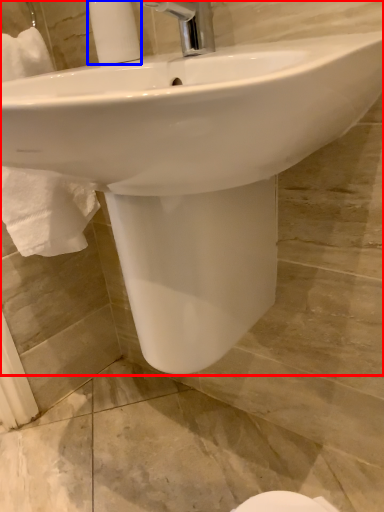
Question: Which of the following is the farthest to the observer, sink (highlighted by a red box) or soap dispenser (highlighted by a blue box)?

Choices:
 (A) sink
 (B) soap dispenser

Answer: (B)